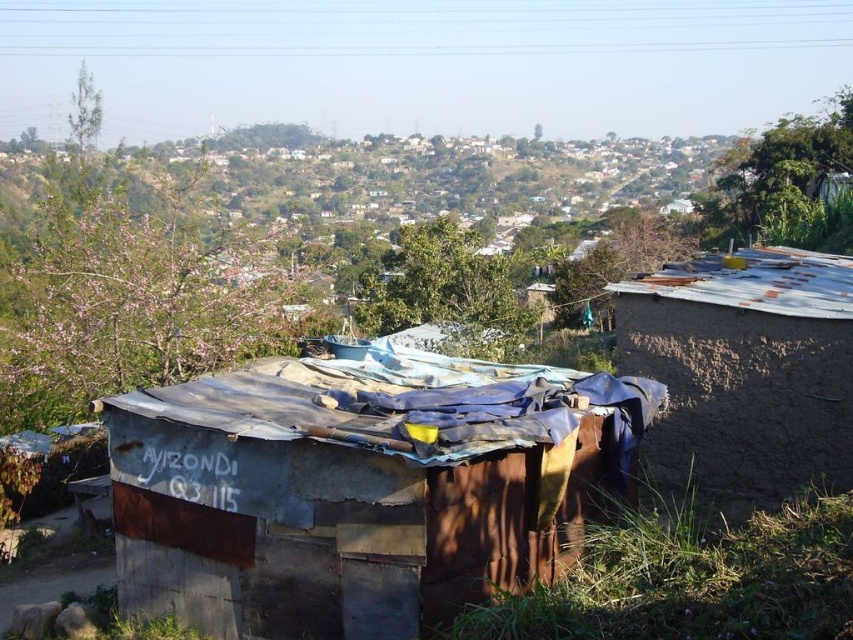
Who is lower down, rusty corrugated hut at center or brown mud hut at right?

rusty corrugated hut at center is below.

Is rusty corrugated hut at center to the left of brown mud hut at right from the viewer's perspective?

Yes, rusty corrugated hut at center is to the left of brown mud hut at right.

Is point (315, 628) positioned in front of point (699, 301)?

Yes.

At what (x,y) coordinates should I click in order to perform the action: click on rusty corrugated hut at center. Please return your answer as a coordinate pair (x, y). Image resolution: width=853 pixels, height=640 pixels. Looking at the image, I should click on (355, 499).